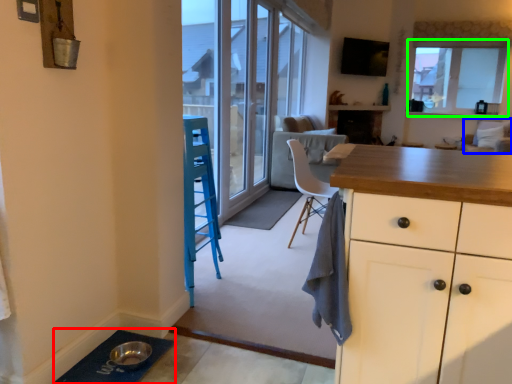
Question: Which object is positioned closest to doormat (highlighted by a red box)? Select from armchair (highlighted by a blue box) and window (highlighted by a green box).

Choices:
 (A) armchair
 (B) window

Answer: (A)